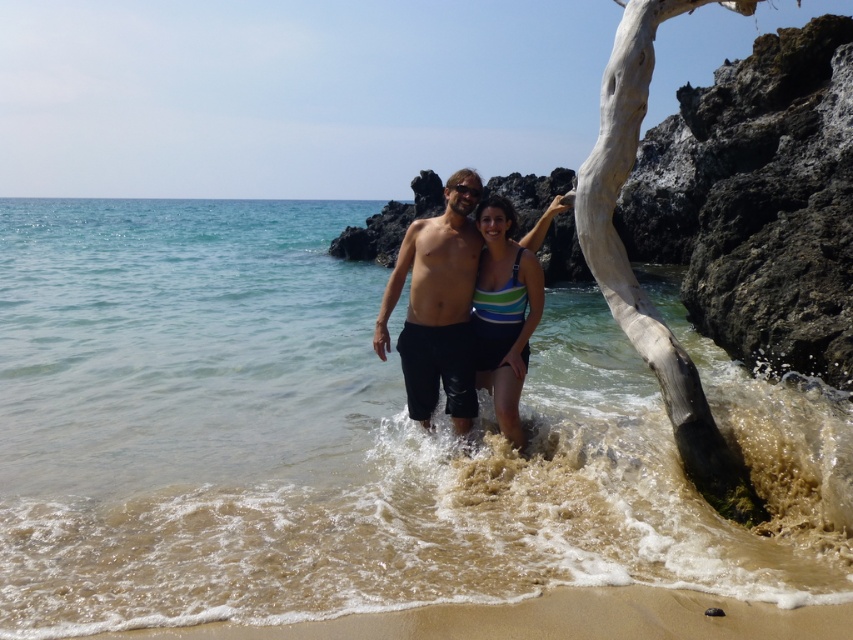
Image resolution: width=853 pixels, height=640 pixels. I want to click on matte black shorts at center, so click(x=462, y=307).

Who is higher up, matte black shorts at center or white textured driftwood at center?

white textured driftwood at center

Who is more forward, (x=461, y=182) or (x=743, y=518)?

Positioned in front is point (x=743, y=518).

The height and width of the screenshot is (640, 853). I want to click on matte black shorts at center, so click(462, 307).

Does clear water at center appear on the left side of matte black shorts at center?

Indeed, clear water at center is positioned on the left side of matte black shorts at center.

Which is below, clear water at center or matte black shorts at center?

Positioned lower is matte black shorts at center.

Is point (230, 538) positioned in front of point (550, 211)?

Yes, it is.

Where is `clear water at center`? The height and width of the screenshot is (640, 853). clear water at center is located at coordinates (x=349, y=438).

Does clear water at center have a smaller size compared to striped fabric swimsuit at center?

No, clear water at center is not smaller than striped fabric swimsuit at center.

Find the location of a particular element. This screenshot has height=640, width=853. clear water at center is located at coordinates (349, 438).

Which is behind, point (53, 355) or point (521, 339)?

The point (53, 355) is more distant.

I want to click on clear water at center, so click(349, 438).